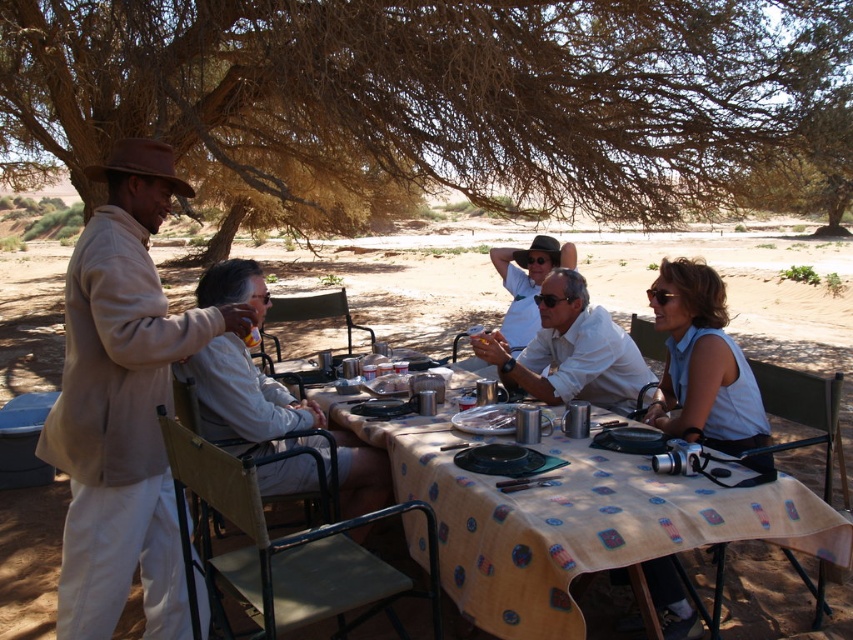
Question: Which point is farther from the camera taking this photo?

Choices:
 (A) pos(717,12)
 (B) pos(788,545)
 (C) pos(682,621)

Answer: (A)

Question: Is beige cotton shirt at left closer to camera compared to white matte shirt at center?

Choices:
 (A) no
 (B) yes

Answer: (B)

Question: Is yellow fabric table at center positioned before white matte shirt at center?

Choices:
 (A) yes
 (B) no

Answer: (A)

Question: Which point is farther to the camera?

Choices:
 (A) light beige fabric chair at center
 (B) brown textured tree at upper center

Answer: (B)

Question: Can you confirm if beige cotton shirt at left is positioned below yellow fabric table at center?

Choices:
 (A) no
 (B) yes

Answer: (A)

Question: Estimate the real-world distances between objects in this image. Which object is closer to the brown textured tree at upper center?

Choices:
 (A) matte white shirt at center
 (B) yellow fabric table at center
 (C) beige cotton shirt at left

Answer: (A)